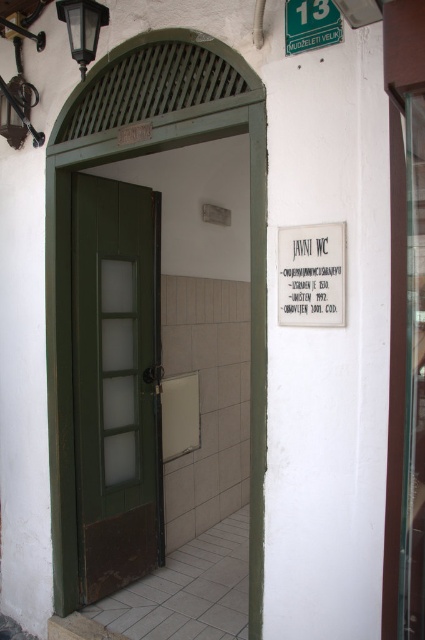
Question: Which object is positioned closest to the white paper sign at center?

Choices:
 (A) green wood door at center
 (B) green plastic sign at upper center
 (C) green matte door at center

Answer: (C)

Question: Based on their relative distances, which object is farther from the green plastic sign at upper center?

Choices:
 (A) white paper sign at center
 (B) green wood door at center
 (C) green matte door at center

Answer: (B)

Question: Is green matte door at center to the left of white paper sign at center from the viewer's perspective?

Choices:
 (A) yes
 (B) no

Answer: (A)

Question: Is green matte door at center thinner than white paper sign at center?

Choices:
 (A) yes
 (B) no

Answer: (B)

Question: Does green wood door at center have a smaller size compared to green plastic sign at upper center?

Choices:
 (A) no
 (B) yes

Answer: (A)

Question: Which point appears farthest from the camera in this image?

Choices:
 (A) (334, 13)
 (B) (107, 355)
 (C) (240, 108)

Answer: (B)